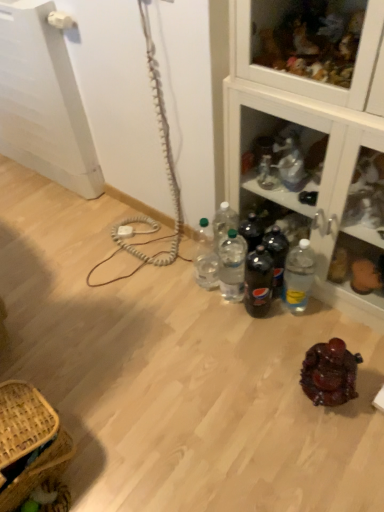
You are a GUI agent. You are given a task and a screenshot of the screen. Output one action in this format:
    pyautogui.click(x=<x>, y=<y>)
    Task: Click on the vacant space in between dark glass bottle at center, the 3th bottle positioned from the right, and clear plastic bottle at lower right, which is counted as the fifth bottle, starting from the left
    
    Given the screenshot: What is the action you would take?
    pyautogui.click(x=284, y=313)